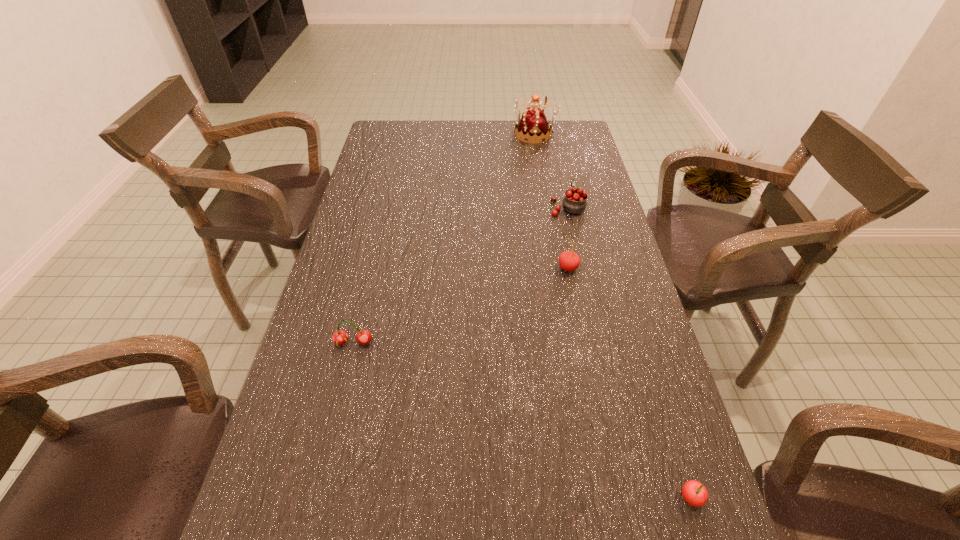
Where is `object present at the far right corner`? The height and width of the screenshot is (540, 960). object present at the far right corner is located at coordinates (533, 124).

Locate an element on the screen. This screenshot has width=960, height=540. vacant space at the far edge of the desktop is located at coordinates click(420, 145).

In the image, there is a desktop. Where is `vacant area at the left edge`? vacant area at the left edge is located at coordinates (310, 439).

In order to click on vacant area at the right edge in this screenshot , I will do `click(575, 152)`.

Identify the location of free location at the far left corner of the desktop. (417, 120).

Locate an element on the screen. The width and height of the screenshot is (960, 540). free region at the far right corner of the desktop is located at coordinates (564, 150).

The width and height of the screenshot is (960, 540). What are the coordinates of `empty space that is in between the rightmost cherry and the tallest object` in the screenshot? It's located at (612, 316).

Where is `free point between the tiara and the rightmost cherry`? The width and height of the screenshot is (960, 540). free point between the tiara and the rightmost cherry is located at coordinates (612, 316).

I want to click on vacant region between the second nearest object and the second farthest cherry, so pos(461,305).

Where is `vacant area that lies between the rightmost object and the third nearest cherry`? This screenshot has height=540, width=960. vacant area that lies between the rightmost object and the third nearest cherry is located at coordinates click(629, 383).